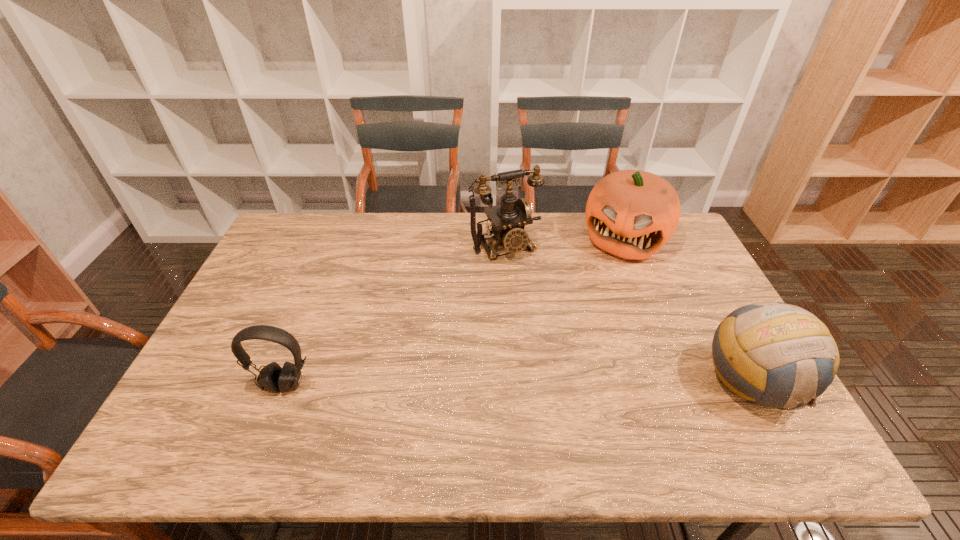
You are a GUI agent. You are given a task and a screenshot of the screen. Output one action in this format:
    pyautogui.click(x=<x>, y=<y>)
    Task: Click on the free space between the headset and the volleyball
    The width and height of the screenshot is (960, 540).
    Given the screenshot: What is the action you would take?
    tap(518, 383)

Where is `vacant space that's between the third object from right to left and the pumpkin`? The height and width of the screenshot is (540, 960). vacant space that's between the third object from right to left and the pumpkin is located at coordinates (564, 242).

Locate an element on the screen. The image size is (960, 540). free area in between the pumpkin and the volleyball is located at coordinates (688, 310).

Image resolution: width=960 pixels, height=540 pixels. I want to click on free spot between the leftmost object and the telephone, so click(x=395, y=315).

Select which object is the third closest to the pumpkin. Please provide its 2D coordinates. Your answer should be formatted as a tuple, i.e. [(x, y)], where the tuple contains the x and y coordinates of a point satisfying the conditions above.

[(272, 378)]

Locate an element on the screen. This screenshot has width=960, height=540. object that is the closest to the volleyball is located at coordinates (631, 214).